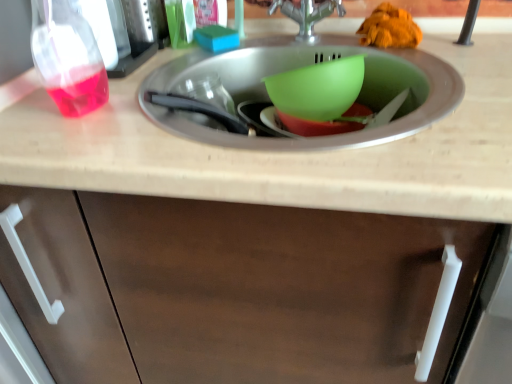
Find the location of a particular element. This screenshot has width=512, height=384. vacant area that lies to the right of transparent plastic spray bottle at left is located at coordinates (185, 56).